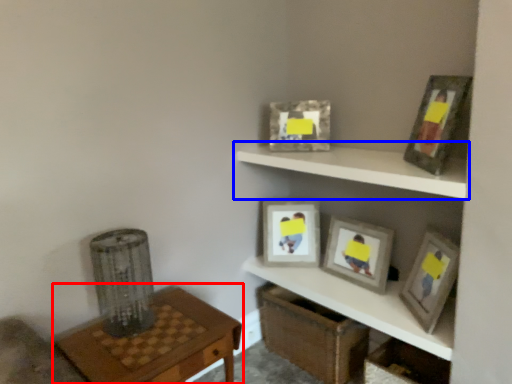
Question: Which object appears closest to the camera in this image, table (highlighted by a red box) or shelf (highlighted by a blue box)?

Choices:
 (A) table
 (B) shelf

Answer: (A)